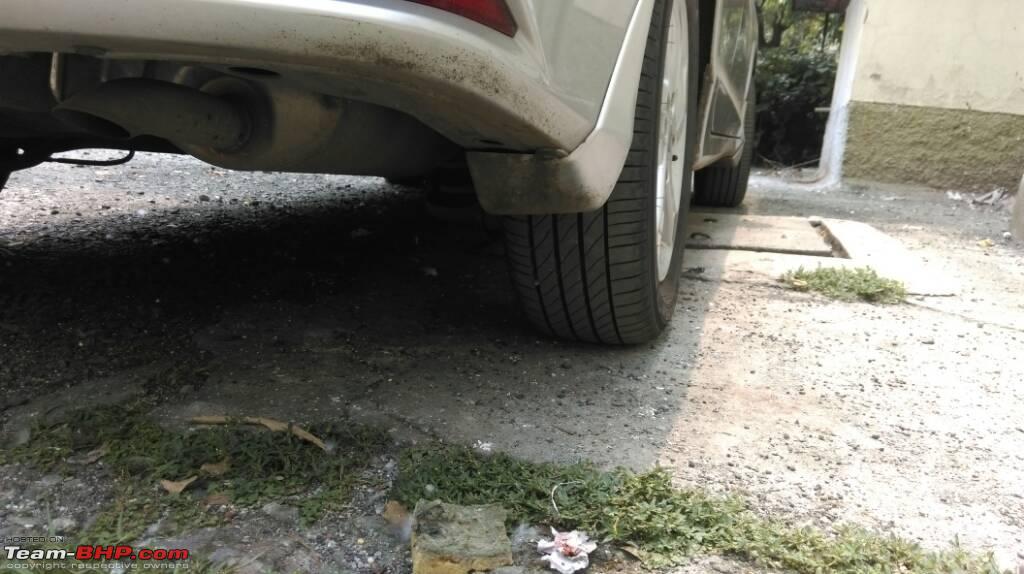
What are the coordinates of `wall` in the screenshot? It's located at (932, 107).